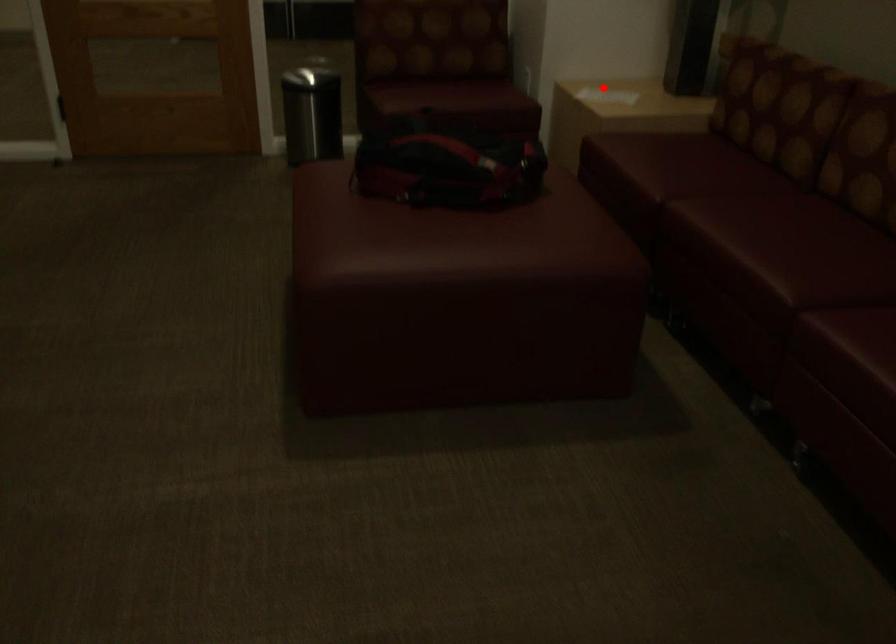
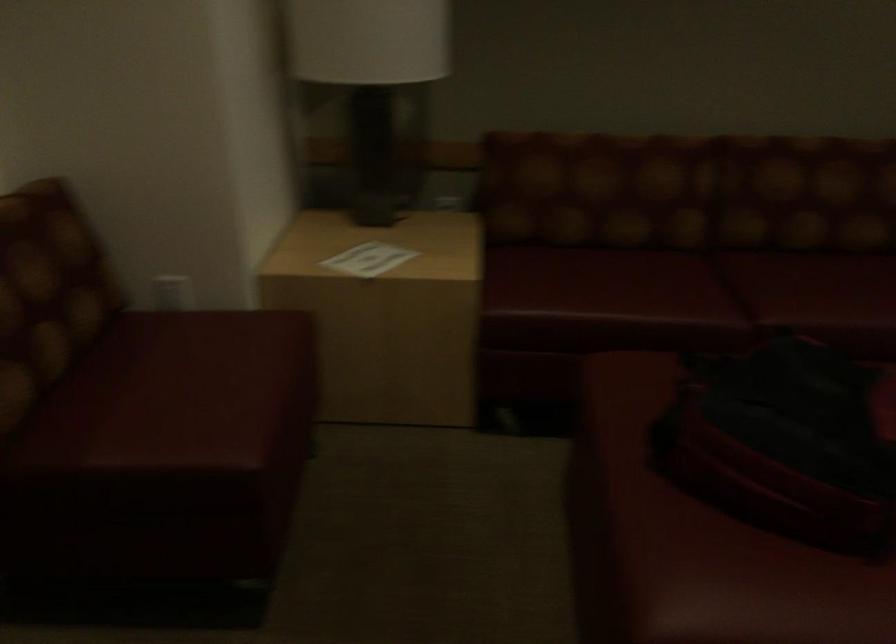
Find the pixel in the second image that matches the highlighted location in the first image.

(367, 259)